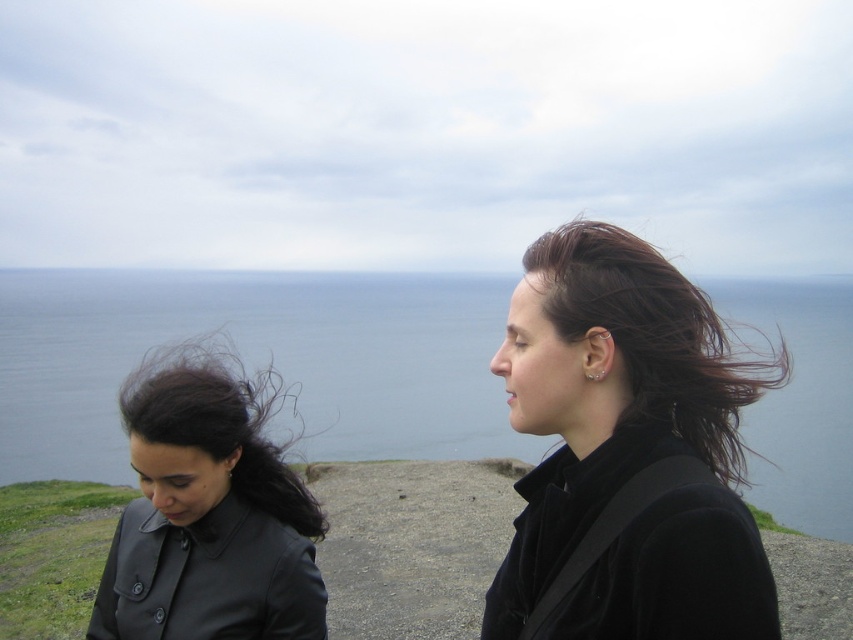
Question: Which point is closer to the camera?

Choices:
 (A) matte black jacket at left
 (B) black velvet jacket at upper right

Answer: (B)

Question: Which object appears farthest from the camera in this image?

Choices:
 (A) black velvet jacket at upper right
 (B) matte black jacket at left
 (C) blue water at center

Answer: (B)

Question: Observing the image, what is the correct spatial positioning of black velvet jacket at upper right in reference to matte black jacket at left?

Choices:
 (A) below
 (B) above

Answer: (B)

Question: Which of the following is the closest to the observer?

Choices:
 (A) (836, 525)
 (B) (640, 516)
 (C) (135, 544)

Answer: (B)

Question: Is blue water at center thinner than black velvet jacket at upper right?

Choices:
 (A) no
 (B) yes

Answer: (A)

Question: Can you confirm if blue water at center is positioned above matte black jacket at left?

Choices:
 (A) yes
 (B) no

Answer: (A)